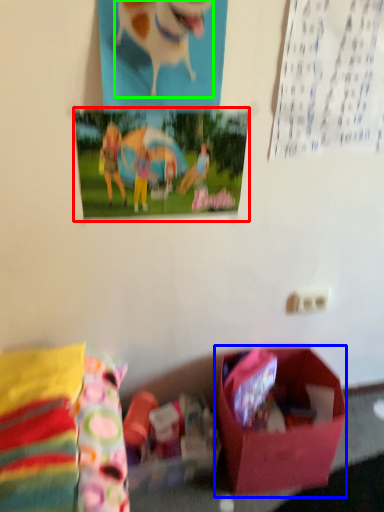
Question: Which is nearer to the postcard (highlighted by a red box)? box (highlighted by a blue box) or animal (highlighted by a green box).

Choices:
 (A) box
 (B) animal

Answer: (B)